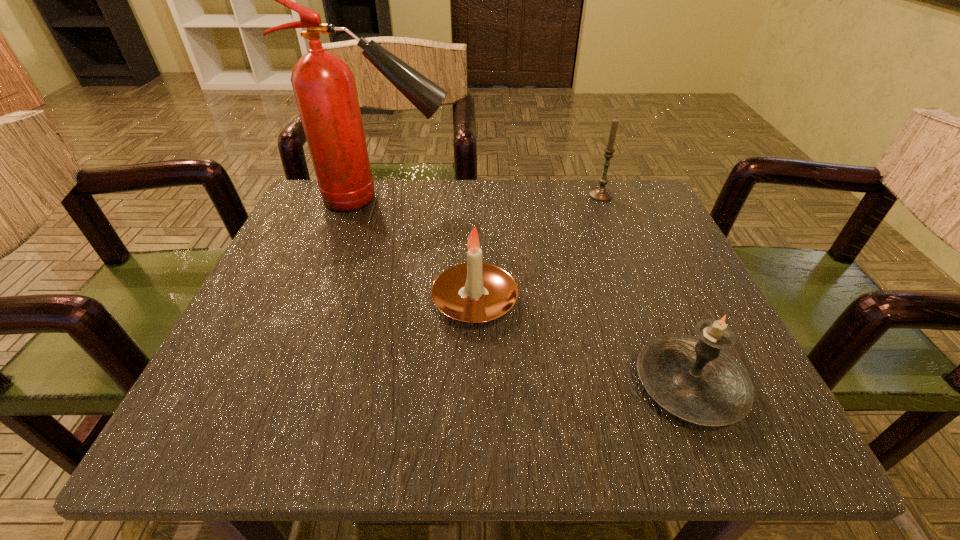
In the image, there is a desktop. At what (x,y) coordinates should I click in order to perform the action: click on vacant area at the far left corner. Please return your answer as a coordinate pair (x, y). The width and height of the screenshot is (960, 540). Looking at the image, I should click on (380, 189).

Find the location of a particular element. This screenshot has width=960, height=540. vacant space at the near left corner is located at coordinates (221, 442).

In the image, there is a desktop. At what (x,y) coordinates should I click in order to perform the action: click on free space at the far right corner. Please return your answer as a coordinate pair (x, y). Looking at the image, I should click on (636, 193).

Identify the location of vacant space at the near right corner of the desktop. The width and height of the screenshot is (960, 540). (731, 441).

I want to click on empty location between the nearest candle and the third farthest object, so click(x=582, y=343).

This screenshot has width=960, height=540. Identify the location of vacant area that lies between the second nearest object and the farthest candle. (538, 248).

In order to click on empty location between the farthest candle and the second nearest object in this screenshot , I will do `click(538, 248)`.

Find the location of a particular element. The width and height of the screenshot is (960, 540). free point between the farthest candle and the nearest object is located at coordinates (645, 290).

Find the location of a particular element. The width and height of the screenshot is (960, 540). empty space that is in between the tallest object and the nearest object is located at coordinates (536, 292).

At what (x,y) coordinates should I click in order to perform the action: click on free spot between the farthest candle and the fire extinguisher. Please return your answer as a coordinate pair (x, y). Image resolution: width=960 pixels, height=540 pixels. Looking at the image, I should click on (492, 197).